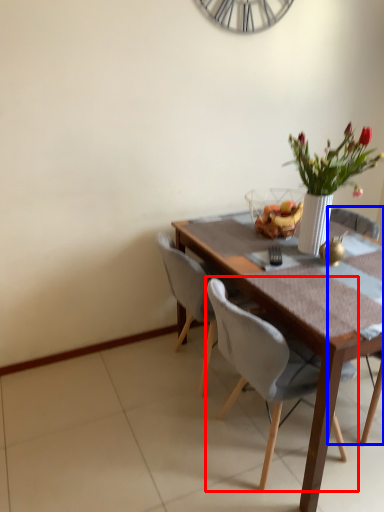
Question: Among these objects, which one is farthest to the camera, chair (highlighted by a red box) or chair (highlighted by a blue box)?

Choices:
 (A) chair
 (B) chair

Answer: (B)